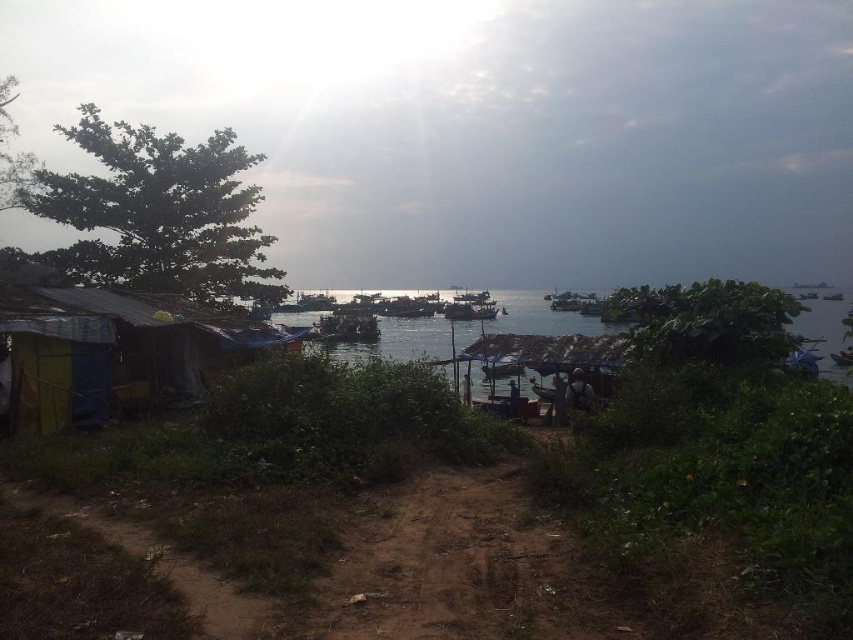
You are a traveler who just arrived at the coastal area and wants to set up a tent. You see the multicolored tarpaulin hut at lower left and the clear water at center. Which location would be more elevated compared to the other?

The multicolored tarpaulin hut at lower left is shorter than clear water at center, so the clear water at center is more elevated than the multicolored tarpaulin hut at lower left.

You are standing at the center of the dirt path in the coastal scene. You want to locate the multicolored tarpaulin hut at lower left. According to the coordinates provided, in which direction should you move relative to your current position?

The multicolored tarpaulin hut at lower left is located at coordinates point (114, 355). Since you are at the center of the dirt path, you should move towards the lower left direction to reach it.